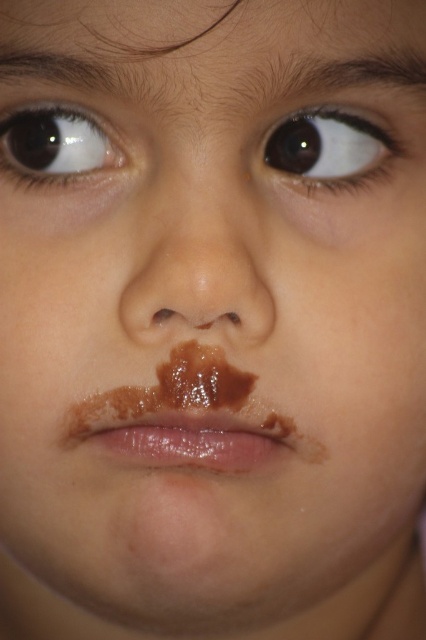
You are a photographer adjusting the focus on a camera. You need to focus on the two points in the image, point 1 at point (x=175, y=250) and point 2 at point (x=0, y=138). Which point should you focus on first if you want to ensure the subject is sharp?

You should focus on point (x=175, y=250) first because it is in front of point (x=0, y=138), making it closer to the camera and thus the main subject.

Consider the image. You are an artist sketching this child. You need to draw the shiny brown nose at center and the brown glossy eye at upper left. Which one should you draw first if you want to follow the left to right direction?

You should draw the brown glossy eye at upper left first because it is positioned to the left of the shiny brown nose at center.

You are a photographer adjusting your camera to focus on the shiny brown nose at center and the brown glossy eye at upper left. Which object should you focus on first to ensure it appears sharp in the photo?

You should focus on the shiny brown nose at center first because it is closer to the viewer than the brown glossy eye at upper left, so focusing on the closer object ensures sharpness before adjusting for depth of field.